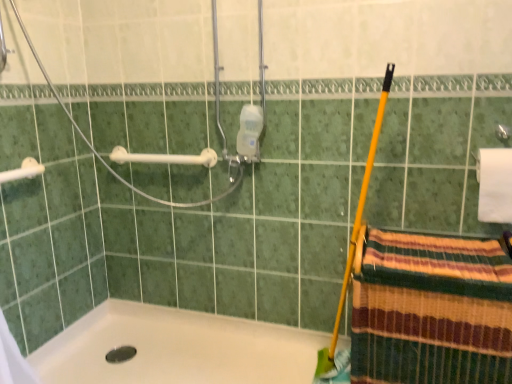
What do you see at coordinates (215, 112) in the screenshot? I see `white plastic shower at upper left` at bounding box center [215, 112].

The image size is (512, 384). What do you see at coordinates (23, 171) in the screenshot? I see `white plastic towel bar at upper left, which is counted as the 1th towel bar, starting from the left` at bounding box center [23, 171].

Locate an element on the screen. This screenshot has width=512, height=384. white plastic towel bar at upper left, the second towel bar when ordered from left to right is located at coordinates pyautogui.click(x=165, y=157).

Describe the element at coordinates (494, 184) in the screenshot. I see `white matte toilet paper at upper right` at that location.

What are the coordinates of `striped woven towel at lower right` in the screenshot? It's located at (431, 310).

The width and height of the screenshot is (512, 384). I want to click on white plastic shower at upper left, so 215,112.

Looking at this image, is white plastic towel bar at upper left, placed as the second towel bar when sorted from right to left, inside or outside of white plastic shower at upper left?

The correct answer is: outside.

From the image's perspective, would you say white plastic towel bar at upper left, which is counted as the 1th towel bar, starting from the left, is positioned over white plastic shower at upper left?

No, from the image's perspective, white plastic towel bar at upper left, which is counted as the 1th towel bar, starting from the left, is not over white plastic shower at upper left.

Does white plastic towel bar at upper left, marked as the 1th towel bar in a front-to-back arrangement, have a lesser height compared to white plastic shower at upper left?

Correct, white plastic towel bar at upper left, marked as the 1th towel bar in a front-to-back arrangement, is not as tall as white plastic shower at upper left.

Which of these two, white plastic towel bar at upper left, which is counted as the 1th towel bar, starting from the left, or white plastic shower at upper left, is thinner?

Thinner between the two is white plastic towel bar at upper left, which is counted as the 1th towel bar, starting from the left.

Are white plastic shower at upper left and white plastic towel bar at upper left, the first towel bar viewed from the back, beside each other?

white plastic shower at upper left is not next to white plastic towel bar at upper left, the first towel bar viewed from the back, and they're not touching.

Is white plastic shower at upper left positioned before white plastic towel bar at upper left, the second towel bar when ordered from left to right?

Yes, it is.

Based on the photo, from the image's perspective, is white plastic shower at upper left on top of white plastic towel bar at upper left, the second towel bar when ordered from left to right?

Indeed, from the image's perspective, white plastic shower at upper left is shown above white plastic towel bar at upper left, the second towel bar when ordered from left to right.

Is point (215, 47) closer to camera compared to point (169, 157)?

Yes, point (215, 47) is closer to viewer.

From the image's perspective, relative to white plastic towel bar at upper left, the second towel bar viewed from the front, is white glossy bathtub at lower left above or below?

From the image's perspective, white glossy bathtub at lower left appears below white plastic towel bar at upper left, the second towel bar viewed from the front.

Which object is positioned more to the left, white glossy bathtub at lower left or white plastic towel bar at upper left, the second towel bar when ordered from left to right?

white plastic towel bar at upper left, the second towel bar when ordered from left to right.

Does white glossy bathtub at lower left have a lesser height compared to white plastic towel bar at upper left, the 1th towel bar in the right-to-left sequence?

Correct, white glossy bathtub at lower left is not as tall as white plastic towel bar at upper left, the 1th towel bar in the right-to-left sequence.

Considering the sizes of white glossy bathtub at lower left and white plastic towel bar at upper left, the second towel bar when ordered from left to right, in the image, is white glossy bathtub at lower left bigger or smaller than white plastic towel bar at upper left, the second towel bar when ordered from left to right,?

Clearly, white glossy bathtub at lower left is larger in size than white plastic towel bar at upper left, the second towel bar when ordered from left to right.

Considering the points (398, 329) and (217, 93), which point is in front, point (398, 329) or point (217, 93)?

The point (398, 329) is closer.

Is striped woven towel at lower right smaller than white plastic shower at upper left?

Indeed, striped woven towel at lower right has a smaller size compared to white plastic shower at upper left.

Is white plastic shower at upper left surrounded by striped woven towel at lower right?

No.

The image size is (512, 384). I want to click on shower above the striped woven towel at lower right (from a real-world perspective), so click(x=215, y=112).

Can you confirm if white plastic shower at upper left is positioned to the right of white plastic towel bar at upper left, marked as the 1th towel bar in a front-to-back arrangement?

Correct, you'll find white plastic shower at upper left to the right of white plastic towel bar at upper left, marked as the 1th towel bar in a front-to-back arrangement.

Choose the correct answer: Is white plastic shower at upper left inside white plastic towel bar at upper left, placed as the second towel bar when sorted from right to left, or outside it?

white plastic shower at upper left is located beyond the bounds of white plastic towel bar at upper left, placed as the second towel bar when sorted from right to left.

From a real-world perspective, is white plastic shower at upper left physically above white plastic towel bar at upper left, which is counted as the 1th towel bar, starting from the left?

Yes, from a real-world perspective, white plastic shower at upper left is over white plastic towel bar at upper left, which is counted as the 1th towel bar, starting from the left

Considering the relative sizes of white plastic shower at upper left and white plastic towel bar at upper left, placed as the second towel bar when sorted from right to left, in the image provided, is white plastic shower at upper left smaller than white plastic towel bar at upper left, placed as the second towel bar when sorted from right to left,?

No, white plastic shower at upper left is not smaller than white plastic towel bar at upper left, placed as the second towel bar when sorted from right to left.

Which is more to the right, white plastic towel bar at upper left, the second towel bar when ordered from left to right, or white plastic towel bar at upper left, placed as the second towel bar when sorted from right to left?

white plastic towel bar at upper left, the second towel bar when ordered from left to right.

Is white plastic towel bar at upper left, the second towel bar when ordered from left to right, positioned far away from white plastic towel bar at upper left, marked as the 1th towel bar in a front-to-back arrangement?

Actually, white plastic towel bar at upper left, the second towel bar when ordered from left to right, and white plastic towel bar at upper left, marked as the 1th towel bar in a front-to-back arrangement, are a little close together.

Which of these two, white plastic towel bar at upper left, the second towel bar when ordered from left to right, or white plastic towel bar at upper left, which is counted as the 1th towel bar, starting from the left, is bigger?

With larger size is white plastic towel bar at upper left, the second towel bar when ordered from left to right.

From the image's perspective, is white plastic towel bar at upper left, the 1th towel bar in the right-to-left sequence, on white plastic towel bar at upper left, which is counted as the 1th towel bar, starting from the left?

Yes.

From a real-world perspective, between striped woven towel at lower right and white glossy bathtub at lower left, who is vertically lower?

From a 3D spatial view, white glossy bathtub at lower left is below.

This screenshot has width=512, height=384. In order to click on beach towel lying on the right of white glossy bathtub at lower left in this screenshot , I will do `click(431, 310)`.

From the white plastic shower at upper left, count 1st towel bars backward and point to it. Please provide its 2D coordinates.

[(23, 171)]

Where is `shower that appears above the white plastic towel bar at upper left, the 1th towel bar in the right-to-left sequence (from a real-world perspective)`? The width and height of the screenshot is (512, 384). shower that appears above the white plastic towel bar at upper left, the 1th towel bar in the right-to-left sequence (from a real-world perspective) is located at coordinates (215, 112).

Estimate the real-world distances between objects in this image. Which object is closer to striped woven towel at lower right, white glossy bathtub at lower left or white matte toilet paper at upper right?

Among the two, white matte toilet paper at upper right is located nearer to striped woven towel at lower right.

Consider the image. Considering their positions, is white matte toilet paper at upper right positioned further to striped woven towel at lower right than white glossy bathtub at lower left?

Based on the image, white glossy bathtub at lower left appears to be further to striped woven towel at lower right.

When comparing their distances from white glossy bathtub at lower left, does white plastic towel bar at upper left, marked as the 1th towel bar in a front-to-back arrangement, or white plastic shower at upper left seem further?

Based on the image, white plastic towel bar at upper left, marked as the 1th towel bar in a front-to-back arrangement, appears to be further to white glossy bathtub at lower left.

Considering their positions, is white plastic shower at upper left positioned closer to striped woven towel at lower right than white matte toilet paper at upper right?

white matte toilet paper at upper right.

Looking at the image, which one is located further to white plastic towel bar at upper left, positioned as the second towel bar in back-to-front order, white plastic shower at upper left or white matte toilet paper at upper right?

The object further to white plastic towel bar at upper left, positioned as the second towel bar in back-to-front order, is white matte toilet paper at upper right.

Considering their positions, is white plastic towel bar at upper left, positioned as the second towel bar in back-to-front order, positioned further to striped woven towel at lower right than white plastic towel bar at upper left, the first towel bar viewed from the back?

Among the two, white plastic towel bar at upper left, positioned as the second towel bar in back-to-front order, is located further to striped woven towel at lower right.

From the image, which object appears to be farther from white plastic towel bar at upper left, the second towel bar when ordered from left to right, striped woven towel at lower right or white plastic towel bar at upper left, which is counted as the 1th towel bar, starting from the left?

striped woven towel at lower right.

Considering their positions, is white glossy bathtub at lower left positioned further to white plastic shower at upper left than striped woven towel at lower right?

striped woven towel at lower right.

You are a GUI agent. You are given a task and a screenshot of the screen. Output one action in this format:
    pyautogui.click(x=<x>, y=<y>)
    Task: Click on the towel bar between white plastic towel bar at upper left, marked as the 1th towel bar in a front-to-back arrangement, and white matte toilet paper at upper right, in the horizontal direction
    
    Given the screenshot: What is the action you would take?
    pyautogui.click(x=165, y=157)

Where is `bathtub situated between white plastic towel bar at upper left, placed as the second towel bar when sorted from right to left, and striped woven towel at lower right from left to right`? bathtub situated between white plastic towel bar at upper left, placed as the second towel bar when sorted from right to left, and striped woven towel at lower right from left to right is located at coordinates (176, 348).

Image resolution: width=512 pixels, height=384 pixels. I want to click on towel bar between white plastic towel bar at upper left, the second towel bar viewed from the front, and white glossy bathtub at lower left from top to bottom, so click(x=23, y=171).

The height and width of the screenshot is (384, 512). I want to click on shower situated between white plastic towel bar at upper left, the second towel bar viewed from the front, and white matte toilet paper at upper right from left to right, so click(x=215, y=112).